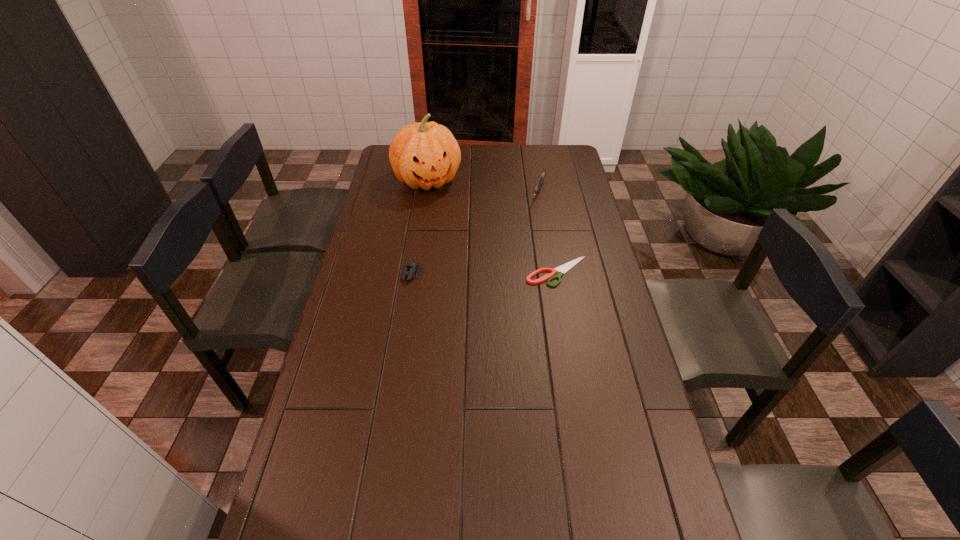
Where is `free space between the scissors and the gun`? Image resolution: width=960 pixels, height=540 pixels. free space between the scissors and the gun is located at coordinates (548, 232).

Identify which object is the nearest to the second shortest object. Please provide its 2D coordinates. Your answer should be formatted as a tuple, i.e. [(x, y)], where the tuple contains the x and y coordinates of a point satisfying the conditions above.

[(562, 269)]

Select which object appears as the closest to the scissors. Please provide its 2D coordinates. Your answer should be formatted as a tuple, i.e. [(x, y)], where the tuple contains the x and y coordinates of a point satisfying the conditions above.

[(541, 179)]

The width and height of the screenshot is (960, 540). What are the coordinates of `free space that satisfies the following two spatial constraints: 1. on the front side of the shortest object; 2. on the right side of the third shortest object` in the screenshot? It's located at (551, 272).

Where is `free space that satisfies the following two spatial constraints: 1. on the front side of the gun; 2. on the left side of the scissors`? The width and height of the screenshot is (960, 540). free space that satisfies the following two spatial constraints: 1. on the front side of the gun; 2. on the left side of the scissors is located at coordinates (551, 272).

Find the location of a particular element. This screenshot has width=960, height=540. free region that satisfies the following two spatial constraints: 1. on the back side of the third tallest object; 2. on the left side of the shortest object is located at coordinates (411, 272).